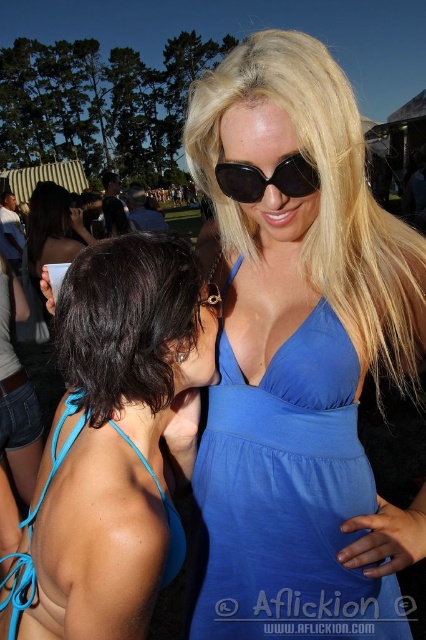
The image size is (426, 640). What do you see at coordinates (112, 444) in the screenshot?
I see `blue fabric bikini top at left` at bounding box center [112, 444].

Can you confirm if blue fabric bikini top at left is shorter than shiny dark hair at center?

No.

The image size is (426, 640). I want to click on blue fabric bikini top at left, so click(112, 444).

Is point (140, 243) closer to camera compared to point (305, 160)?

No, it is behind (305, 160).

Which is in front, point (149, 320) or point (241, 202)?

Positioned in front is point (149, 320).

Between point (155, 374) and point (284, 179), which one is positioned in front?

Point (284, 179) is more forward.

Where is `blue fabric bikini top at left`? Image resolution: width=426 pixels, height=640 pixels. blue fabric bikini top at left is located at coordinates (112, 444).

Can you confirm if blue fabric dress at center is taller than shiny dark hair at center?

Yes.

Does blue fabric dress at center have a lesser width compared to shiny dark hair at center?

No, blue fabric dress at center is not thinner than shiny dark hair at center.

The width and height of the screenshot is (426, 640). What are the coordinates of `blue fabric dress at center` in the screenshot? It's located at (285, 499).

The width and height of the screenshot is (426, 640). Identify the location of blue fabric dress at center. (285, 499).